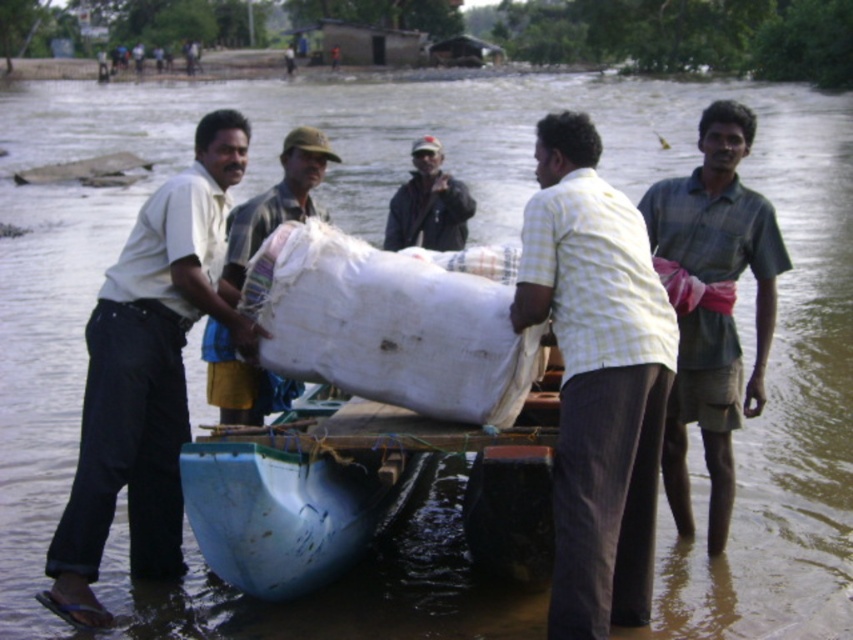
You are a photographer trying to capture a photo of the rescue operation. You notice two people wearing the light yellow checkered shirt at center and the white cotton shirt at left. Which shirt is more to the right in the image?

The light yellow checkered shirt at center is positioned on the right side of the white cotton shirt at left, so the light yellow checkered shirt at center is more to the right.

You are a relief worker in the flooded area. You need to distribute shirts to survivors. You have a white cotton shirt at left and a green cotton shirt at right. Which shirt should you choose if you need to cover a larger body?

The white cotton shirt at left has a larger size compared to the green cotton shirt at right, so you should choose the white cotton shirt at left to cover a larger body.